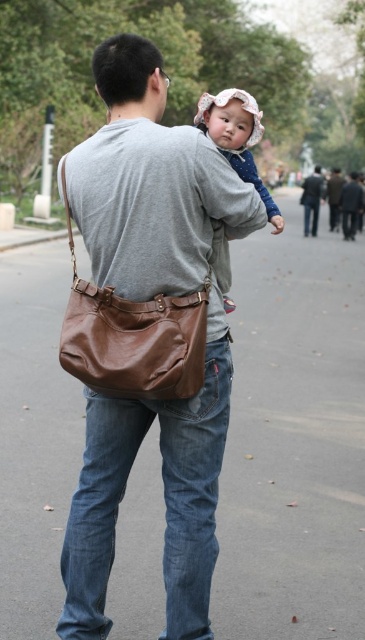
Question: Which of the following is the farthest from the observer?

Choices:
 (A) (331, 188)
 (B) (97, 456)

Answer: (A)

Question: Does matte pink hat at upper center have a greater width compared to dark gray jacket at center?

Choices:
 (A) no
 (B) yes

Answer: (A)

Question: Considering the real-world distances, which object is closest to the dark gray jacket at center?

Choices:
 (A) brown leather messenger bag at left
 (B) dark gray leather jacket at upper center
 (C) brown leather bag at center

Answer: (B)

Question: Can you confirm if matte pink hat at upper center is positioned above dark gray jacket at center?

Choices:
 (A) yes
 (B) no

Answer: (B)

Question: Which is farther from the brown leather messenger bag at left?

Choices:
 (A) dark gray jacket at center
 (B) brown leather bag at center

Answer: (A)

Question: Is brown leather messenger bag at left closer to the viewer compared to matte pink hat at upper center?

Choices:
 (A) yes
 (B) no

Answer: (A)